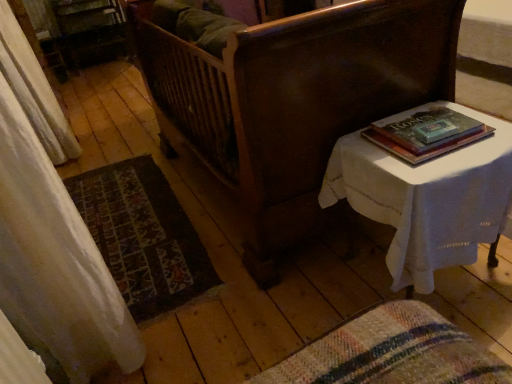
Question: Is hardcover book at upper right facing towards white cloth-covered table at right?

Choices:
 (A) no
 (B) yes

Answer: (A)

Question: Can you confirm if hardcover book at upper right is shorter than white cloth-covered table at right?

Choices:
 (A) no
 (B) yes

Answer: (B)

Question: Is hardcover book at upper right further to camera compared to white cloth-covered table at right?

Choices:
 (A) no
 (B) yes

Answer: (B)

Question: Is hardcover book at upper right oriented away from white cloth-covered table at right?

Choices:
 (A) no
 (B) yes

Answer: (A)

Question: Does hardcover book at upper right contain white cloth-covered table at right?

Choices:
 (A) no
 (B) yes

Answer: (A)

Question: Considering the positions of dark wood bed at center and white cloth-covered table at right in the image, is dark wood bed at center bigger or smaller than white cloth-covered table at right?

Choices:
 (A) small
 (B) big

Answer: (B)

Question: Would you say dark wood bed at center is to the left or to the right of white cloth-covered table at right in the picture?

Choices:
 (A) left
 (B) right

Answer: (A)

Question: In terms of width, does dark wood bed at center look wider or thinner when compared to white cloth-covered table at right?

Choices:
 (A) wide
 (B) thin

Answer: (A)

Question: Is dark wood bed at center spatially inside white cloth-covered table at right, or outside of it?

Choices:
 (A) inside
 (B) outside

Answer: (B)

Question: Is hardcover book at upper right wider or thinner than carpeted mat at lower left?

Choices:
 (A) thin
 (B) wide

Answer: (A)

Question: Visually, is hardcover book at upper right positioned to the left or to the right of carpeted mat at lower left?

Choices:
 (A) left
 (B) right

Answer: (B)

Question: Is hardcover book at upper right inside the boundaries of carpeted mat at lower left, or outside?

Choices:
 (A) outside
 (B) inside

Answer: (A)

Question: From the image's perspective, relative to carpeted mat at lower left, is hardcover book at upper right above or below?

Choices:
 (A) below
 (B) above

Answer: (B)

Question: Which is correct: white cloth-covered table at right is inside carpeted mat at lower left, or outside of it?

Choices:
 (A) outside
 (B) inside

Answer: (A)

Question: From a real-world perspective, is white cloth-covered table at right positioned above or below carpeted mat at lower left?

Choices:
 (A) below
 (B) above

Answer: (B)